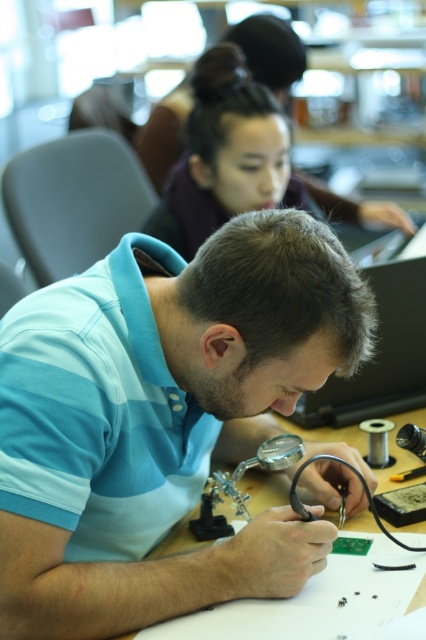
Find the location of a particular element. blue striped shirt at center is located at coordinates (163, 419).

Is point (118, 442) farther from viewer compared to point (198, 545)?

That is False.

The height and width of the screenshot is (640, 426). In order to click on blue striped shirt at center in this screenshot , I will do `click(163, 419)`.

Who is taller, matte purple shirt at upper center or wooden table at center?

Standing taller between the two is matte purple shirt at upper center.

Is point (264, 186) behind point (264, 484)?

Yes, point (264, 186) is behind point (264, 484).

Is point (256, 102) positioned behind point (267, 476)?

That is True.

Where is `matte purple shirt at upper center`? This screenshot has width=426, height=640. matte purple shirt at upper center is located at coordinates (238, 161).

Is point (42, 358) closer to camera compared to point (146, 227)?

Yes, it is in front of point (146, 227).

Consider the image. Between blue striped shirt at center and matte purple shirt at upper center, which one has more height?

Standing taller between the two is blue striped shirt at center.

Who is more distant from viewer, (219, 280) or (204, 93)?

The point (204, 93) is more distant.

In order to click on blue striped shirt at center in this screenshot , I will do `click(163, 419)`.